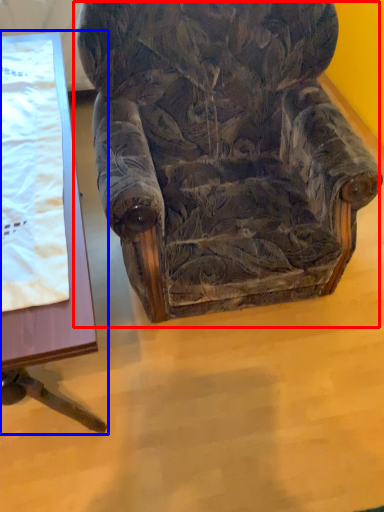
Question: Which object is closer to the camera taking this photo, chair (highlighted by a red box) or table (highlighted by a blue box)?

Choices:
 (A) chair
 (B) table

Answer: (A)